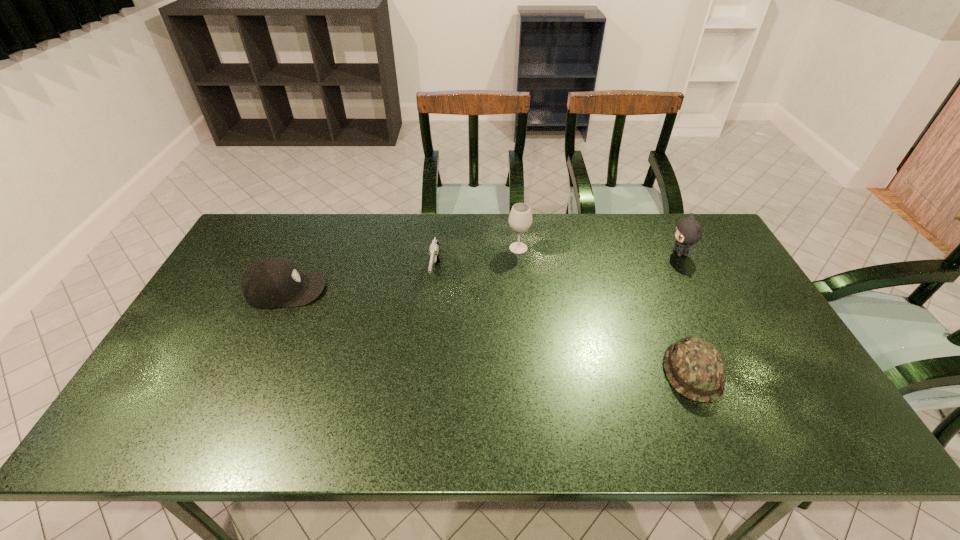
Find the location of a particular element. This screenshot has height=540, width=960. vacant position in the image that satisfies the following two spatial constraints: 1. on the front-facing side of the shorter headwear; 2. on the right side of the leftmost object is located at coordinates (248, 372).

The width and height of the screenshot is (960, 540). What are the coordinates of `vacant space that satisfies the following two spatial constraints: 1. on the front-facing side of the kitten; 2. at the muzzle of the second object from left to right` in the screenshot? It's located at (691, 274).

Identify the location of free spot that satisfies the following two spatial constraints: 1. on the front-facing side of the kitten; 2. at the muzzle of the fourth object from right to left. (691, 274).

At what (x,y) coordinates should I click in order to perform the action: click on vacant point that satisfies the following two spatial constraints: 1. at the muzzle of the gun; 2. on the left side of the nearest object. Please return your answer as a coordinate pair (x, y). Image resolution: width=960 pixels, height=540 pixels. Looking at the image, I should click on tap(425, 372).

Locate an element on the screen. The image size is (960, 540). vacant position in the image that satisfies the following two spatial constraints: 1. at the muzzle of the fourth object from right to left; 2. on the front-facing side of the left headwear is located at coordinates (434, 289).